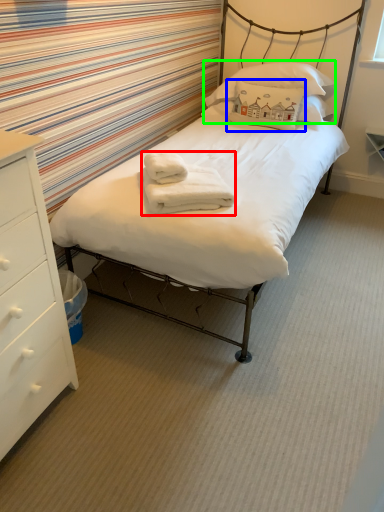
Question: Which object is positioned farthest from bath towel (highlighted by a red box)? Select from pillow (highlighted by a blue box) and pillow (highlighted by a green box).

Choices:
 (A) pillow
 (B) pillow

Answer: (B)